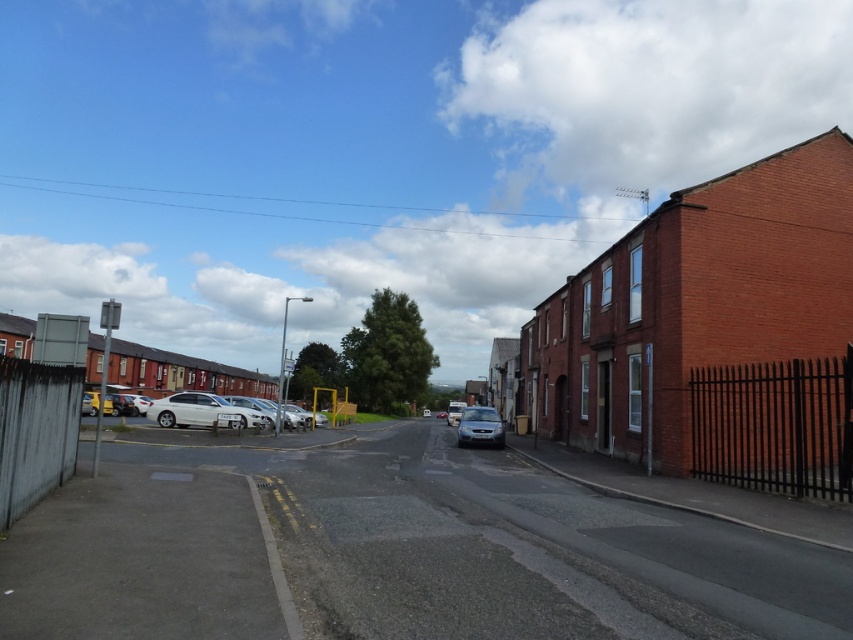
Question: Estimate the real-world distances between objects in this image. Which object is farther from the satin silver car at center?

Choices:
 (A) silver metallic car at center
 (B) white matte car at lower left

Answer: (A)

Question: Can you confirm if white matte sedan at center is thinner than satin silver car at center?

Choices:
 (A) no
 (B) yes

Answer: (A)

Question: Is white matte sedan at center below satin silver car at center?

Choices:
 (A) no
 (B) yes

Answer: (A)

Question: Based on their relative distances, which object is farther from the silver metallic car at center?

Choices:
 (A) satin silver car at center
 (B) white matte car at lower left

Answer: (A)

Question: Considering the real-world distances, which object is farthest from the silver metallic car at center?

Choices:
 (A) white matte car at lower left
 (B) white matte sedan at center
 (C) satin silver car at center

Answer: (C)

Question: Can you confirm if white matte sedan at center is bigger than silver metallic car at center?

Choices:
 (A) no
 (B) yes

Answer: (A)